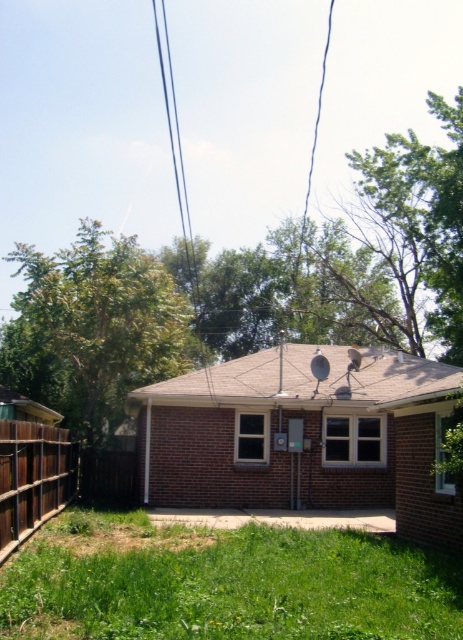
Question: Is green grass at lower center below black wire at upper center?

Choices:
 (A) yes
 (B) no

Answer: (A)

Question: Which point is farther from the camera taking this photo?

Choices:
 (A) tap(438, 592)
 (B) tap(194, 282)

Answer: (B)

Question: Is green grass at lower center to the right of brown wooden fence at lower left from the viewer's perspective?

Choices:
 (A) no
 (B) yes

Answer: (B)

Question: Estimate the real-world distances between objects in this image. Which object is farther from the brown wooden fence at lower left?

Choices:
 (A) green grass at lower center
 (B) black wire at upper center

Answer: (B)

Question: Which point appears closest to the camera in this image?

Choices:
 (A) (177, 176)
 (B) (17, 506)

Answer: (B)

Question: Does green grass at lower center appear under brown wooden fence at lower left?

Choices:
 (A) no
 (B) yes

Answer: (B)